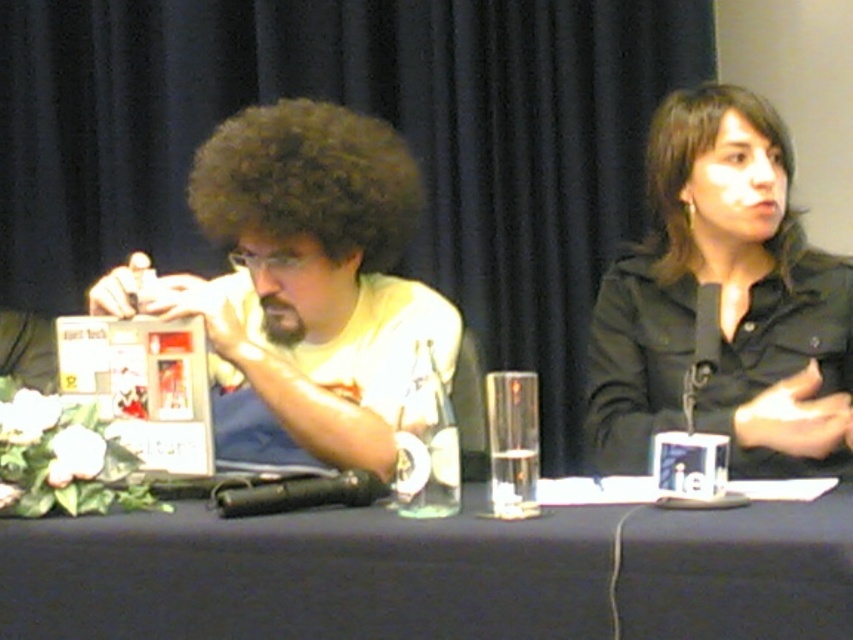
Question: Is black matte shirt at upper right to the right of dark brown curly hair at upper right from the viewer's perspective?

Choices:
 (A) yes
 (B) no

Answer: (B)

Question: Among these objects, which one is farthest from the camera?

Choices:
 (A) dark brown curly hair at center
 (B) black matte shirt at upper right

Answer: (A)

Question: Which point is closer to the camera taking this photo?

Choices:
 (A) (397, 608)
 (B) (326, 298)

Answer: (A)

Question: Does white matte t-shirt at left have a lesser width compared to black matte shirt at upper right?

Choices:
 (A) no
 (B) yes

Answer: (A)

Question: Which of the following is the closest to the observer?

Choices:
 (A) (665, 163)
 (B) (294, 102)
 (C) (230, 396)
 (D) (663, 257)

Answer: (C)

Question: Is black matte shirt at upper right bigger than dark brown curly hair at center?

Choices:
 (A) yes
 (B) no

Answer: (A)